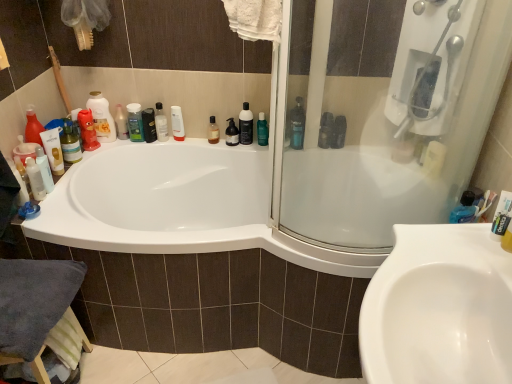
Find the location of `free space above dark gray cotton towel at lower left (from a real-world perspective)`. free space above dark gray cotton towel at lower left (from a real-world perspective) is located at coordinates 23,287.